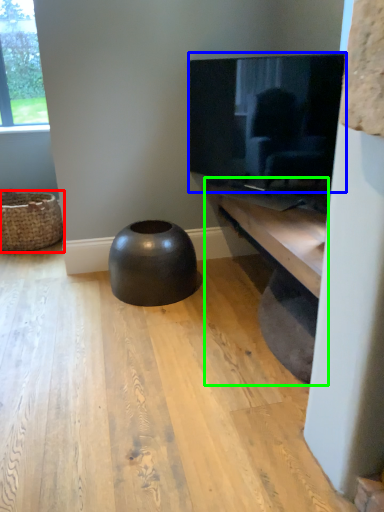
Question: Which object is positioned farthest from basket (highlighted by a red box)? Select from television (highlighted by a blue box) and shelf (highlighted by a green box).

Choices:
 (A) television
 (B) shelf

Answer: (B)